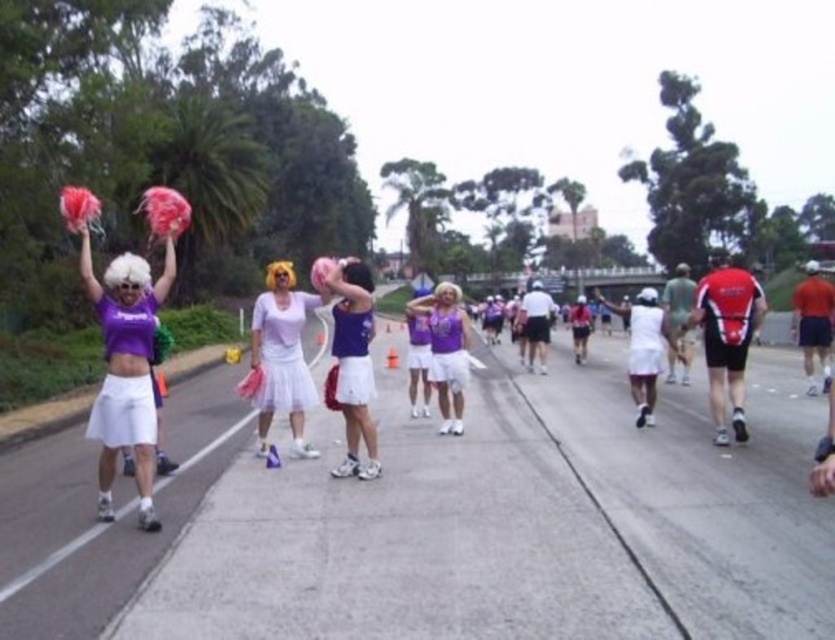
Question: Which point appears closest to the camera in this image?

Choices:
 (A) (721, 298)
 (B) (304, 385)

Answer: (A)

Question: Can you confirm if white asphalt road at center is positioned to the right of purple matte tank top at center?

Choices:
 (A) yes
 (B) no

Answer: (A)

Question: Can you confirm if white asphalt road at center is smaller than purple matte tank top at center?

Choices:
 (A) yes
 (B) no

Answer: (B)

Question: Which object is positioned closest to the purple fabric skirt at center?

Choices:
 (A) white asphalt road at center
 (B) purple matte tank top at center
 (C) white tulle skirt at center
 (D) red fabric shirt at right

Answer: (B)

Question: Based on their relative distances, which object is nearer to the purple fabric skirt at center?

Choices:
 (A) white tulle skirt at center
 (B) purple matte tank top at center
 (C) white asphalt road at center

Answer: (B)

Question: Observing the image, what is the correct spatial positioning of red fabric shirt at right in reference to purple matte tank top at center?

Choices:
 (A) left
 (B) right

Answer: (B)